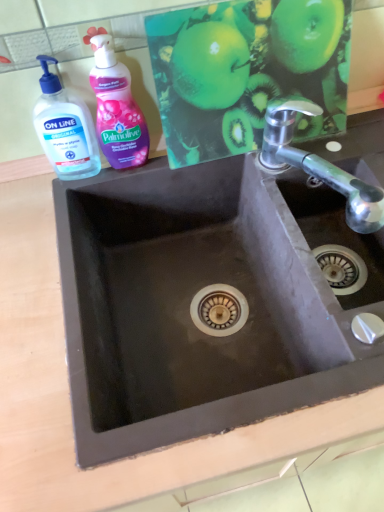
You are a GUI agent. You are given a task and a screenshot of the screen. Output one action in this format:
    pyautogui.click(x=<x>, y=<y>)
    Task: Click on the free point to the left of pink glossy liquid soap at upper left
    The height and width of the screenshot is (512, 384).
    Given the screenshot: What is the action you would take?
    pyautogui.click(x=33, y=193)